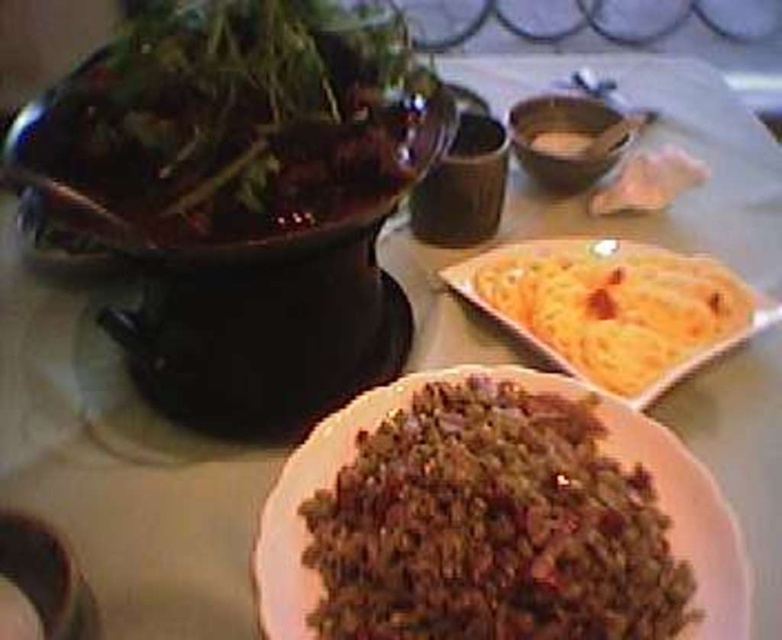
You are a food delivery person who needs to stack the yellow crispy flatbread at upper right and the white matte flatbread at upper right into a small box. Which one should you place at the bottom to prevent the top one from crushing the lower one?

The yellow crispy flatbread at upper right has a greater height compared to the white matte flatbread at upper right, so placing the taller yellow crispy flatbread at upper right at the bottom would prevent the shorter white matte flatbread at upper right from being crushed.

You are a food delivery robot that needs to pick up the yellow crispy flatbread at upper right and the brown matte ground beef at lower center. Which item should you grab first to ensure you don not block the view of the other item while moving?

You should grab the brown matte ground beef at lower center first because it is in front of the yellow crispy flatbread at upper right. Picking up the front item first will prevent blocking the view to the one behind it.

You are a food delivery person who needs to pick up the yellow crispy flatbread at upper right and white matte flatbread at upper right from the table. Which one should you grab first to reach the one on top?

The white matte flatbread at upper right should be grabbed first since the yellow crispy flatbread at upper right is located below it, meaning the white matte flatbread is on top.